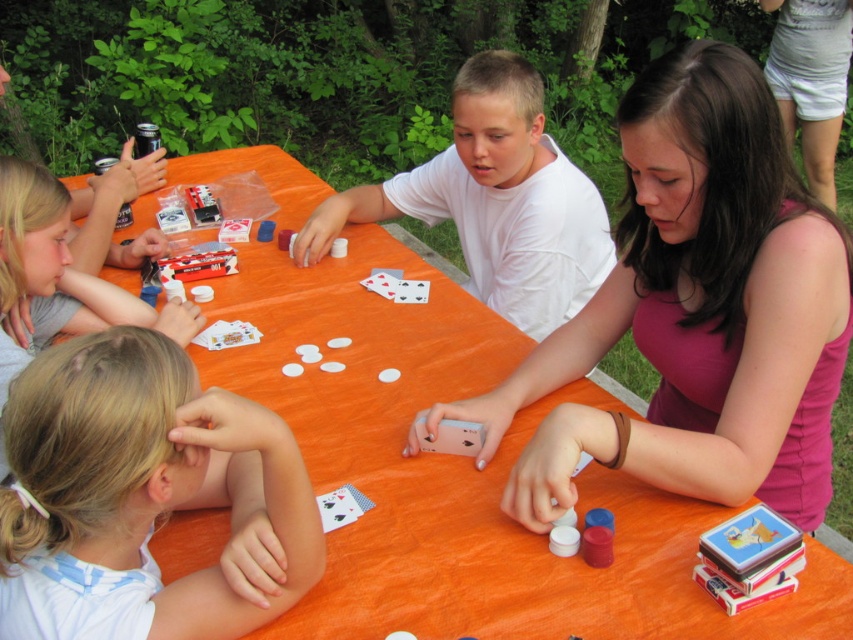
Which is below, pink matte tank top at center or white matte shirt at center?

pink matte tank top at center is lower down.

Can you confirm if pink matte tank top at center is taller than white matte shirt at center?

Indeed, pink matte tank top at center has a greater height compared to white matte shirt at center.

What do you see at coordinates (698, 310) in the screenshot?
I see `pink matte tank top at center` at bounding box center [698, 310].

You are a GUI agent. You are given a task and a screenshot of the screen. Output one action in this format:
    pyautogui.click(x=<x>, y=<y>)
    Task: Click on the pink matte tank top at center
    This screenshot has width=853, height=640.
    Given the screenshot: What is the action you would take?
    pyautogui.click(x=698, y=310)

Between point (535, 198) and point (61, 237), which one is positioned behind?

The point (535, 198) is behind.

Does point (473, 182) come farther from viewer compared to point (28, 340)?

Yes.

Between point (549, 298) and point (61, 244), which one is positioned in front?

Point (61, 244) is more forward.

Find the location of a particular element. Image resolution: width=853 pixels, height=640 pixels. white matte shirt at center is located at coordinates (494, 200).

Who is positioned more to the left, pink matte tank top at center or blonde hair at left?

blonde hair at left is more to the left.

Based on the photo, is pink matte tank top at center further to the viewer compared to blonde hair at left?

Yes.

The image size is (853, 640). What are the coordinates of `pink matte tank top at center` in the screenshot? It's located at (698, 310).

Identify the location of pink matte tank top at center. (698, 310).